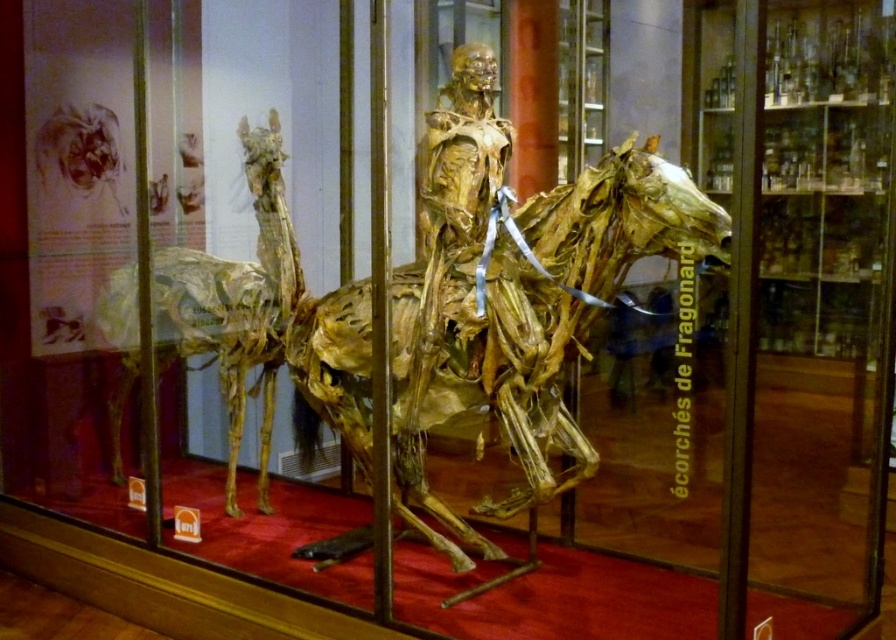
Question: Does brown leather horse at center have a smaller size compared to gold-brown wood horse at left?

Choices:
 (A) no
 (B) yes

Answer: (A)

Question: Which point is farther to the camera?

Choices:
 (A) gold-brown wood horse at left
 (B) brown leather horse at center

Answer: (A)

Question: Can you confirm if brown leather horse at center is positioned below gold-brown wood horse at left?

Choices:
 (A) yes
 (B) no

Answer: (A)

Question: Is brown leather horse at center to the left of gold-brown wood horse at left from the viewer's perspective?

Choices:
 (A) yes
 (B) no

Answer: (B)